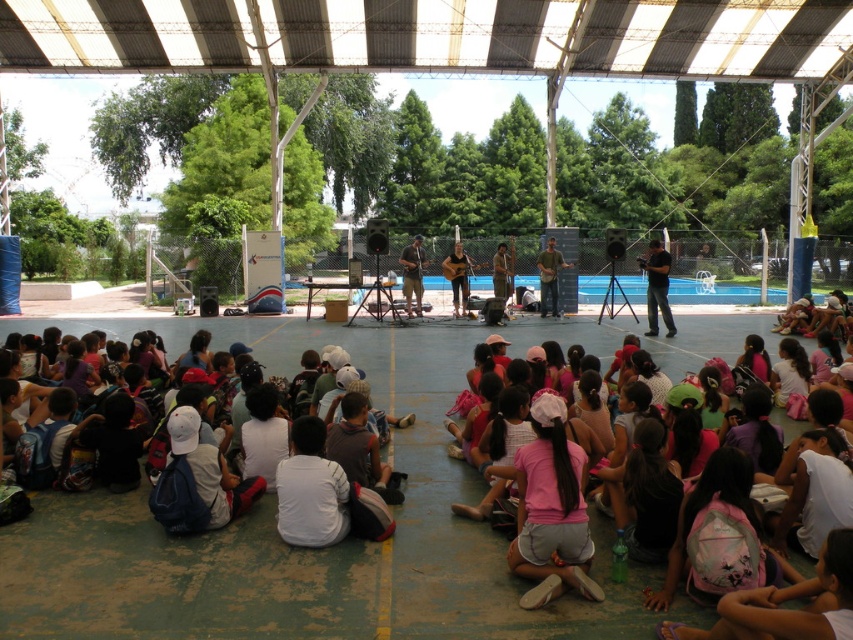
You are a photographer at the event and need to capture a photo of the black matte camera at center without the pink fabric backpacks at lower center blocking the view. Can you adjust your position to do so?

The pink fabric backpacks at lower center are closer to the viewer than the black matte camera at center, so moving your position to a higher angle or behind the backpacks might allow you to see the black matte camera at center without obstruction.

You are a photographer at the event and need to capture a photo of the stage without the pink fabric backpacks at lower center appearing in the frame. Based on their position, which direction should you move your camera to avoid them?

The pink fabric backpacks at lower center are located at point (701, 339). To avoid them, move the camera upwards or to the left to reposition the frame.

You are a photographer at the event and need to capture a photo of the black matte camera at center without the pink fabric backpacks at lower center appearing in the frame. Is this possible given their positions?

The pink fabric backpacks at lower center are positioned below the black matte camera at center, so adjusting the camera angle upwards could exclude the backpacks from the frame.